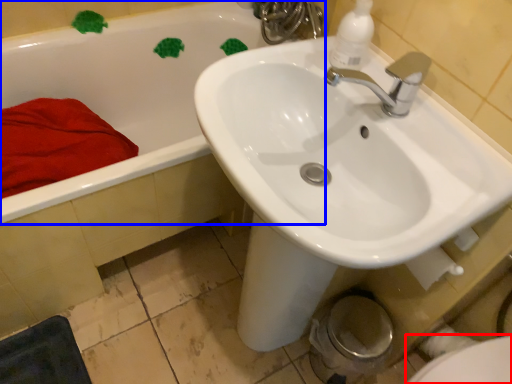
Question: Which object appears farthest to the camera in this image, bidet (highlighted by a red box) or bathtub (highlighted by a blue box)?

Choices:
 (A) bidet
 (B) bathtub

Answer: (B)